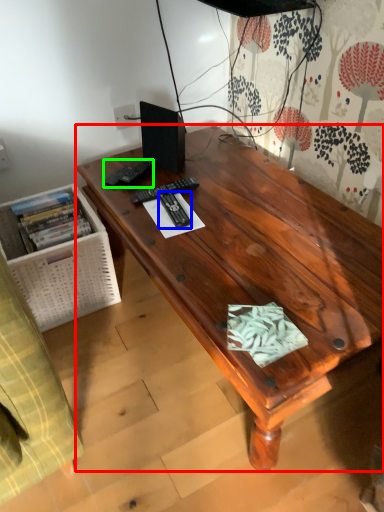
Question: Which is nearer to the desk (highlighted by a red box)? remote control (highlighted by a blue box) or remote control (highlighted by a green box).

Choices:
 (A) remote control
 (B) remote control

Answer: (A)